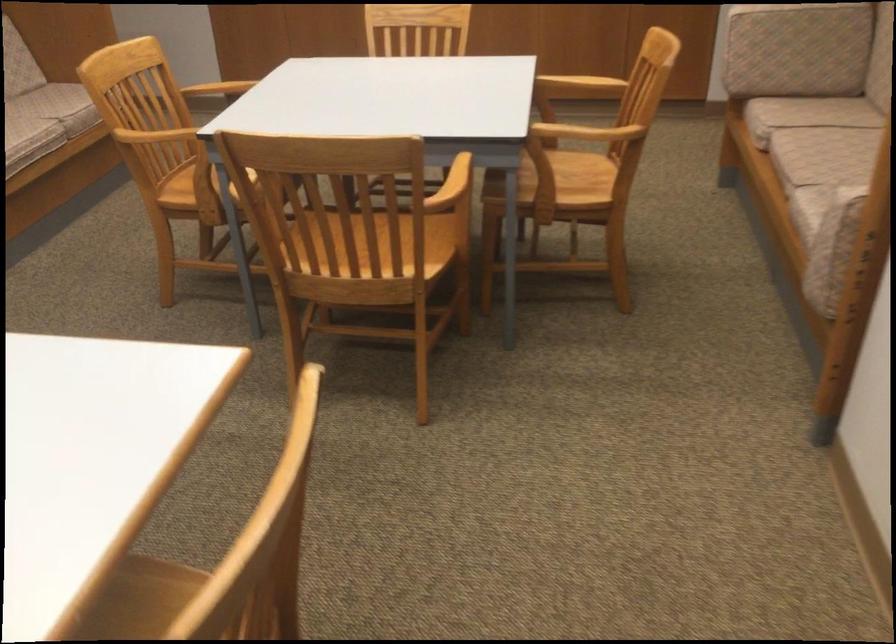
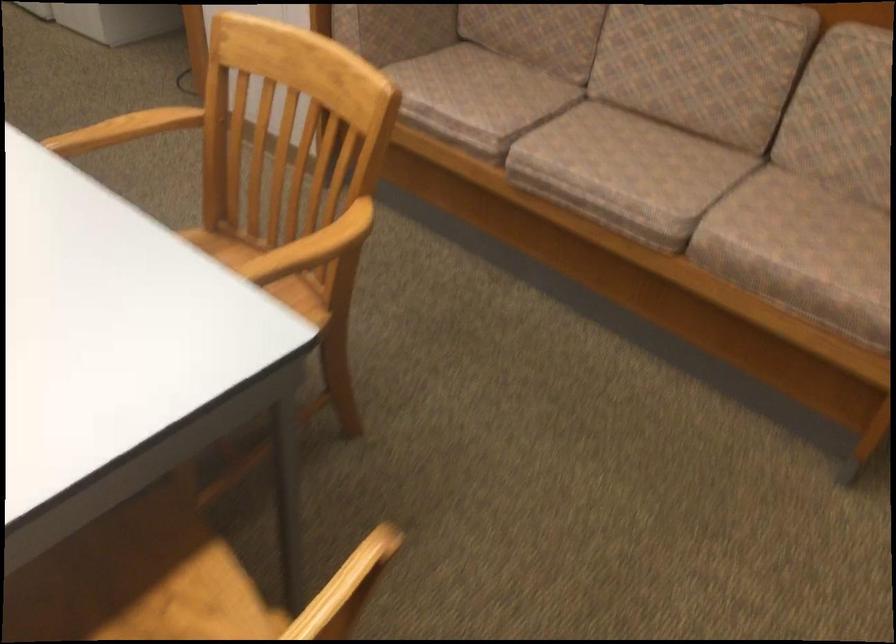
Where in the second image is the point corresponding to point 227,82 from the first image?

(313, 247)